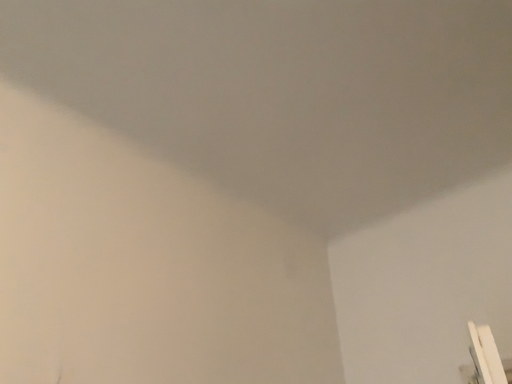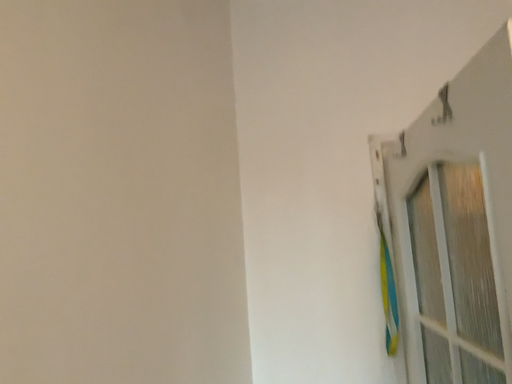
Question: Which way did the camera rotate in the video?

Choices:
 (A) rotated upward
 (B) rotated downward

Answer: (B)